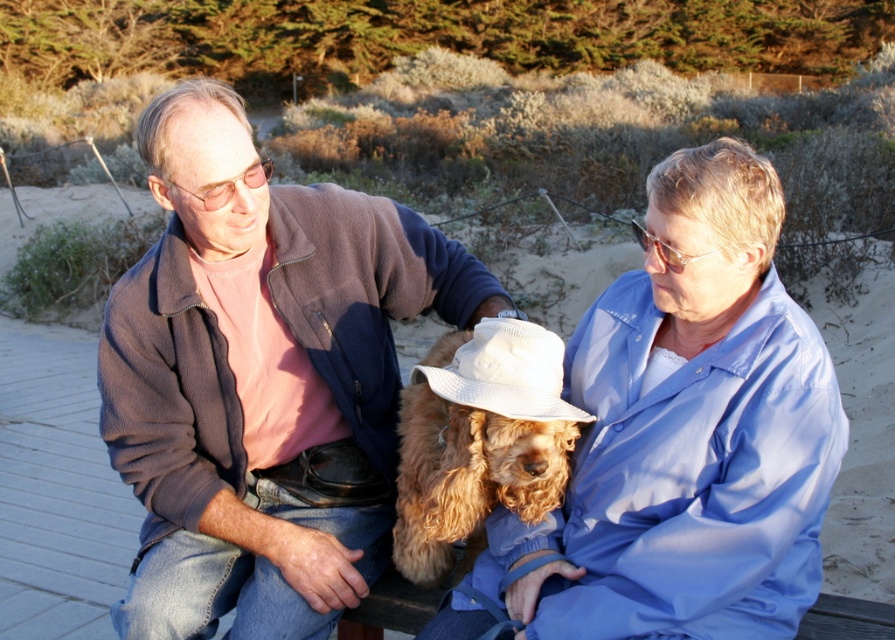
You are a photographer trying to capture a group photo of the light blue fabric shirt at center and the fuzzy brown dog at center. Which object is wider so that you can position them appropriately?

The light blue fabric shirt at center is wider than the fuzzy brown dog at center, so you should position the light blue fabric shirt at center to take up more space in the frame.

You are a photographer planning to take a group photo of the light blue fabric shirt at center and the fuzzy brown dog at center. Which object should you focus on first if you want to ensure both are in focus, considering their sizes?

The light blue fabric shirt at center has a larger size compared to the fuzzy brown dog at center, so you should focus on the larger object first to ensure both are in focus.